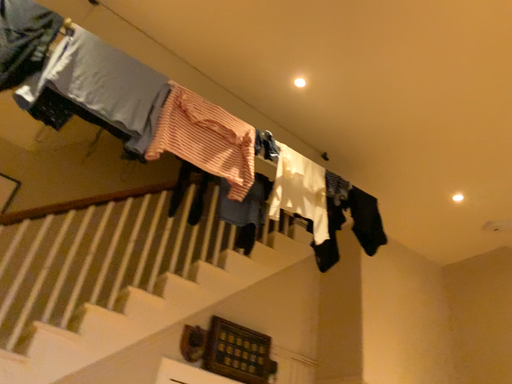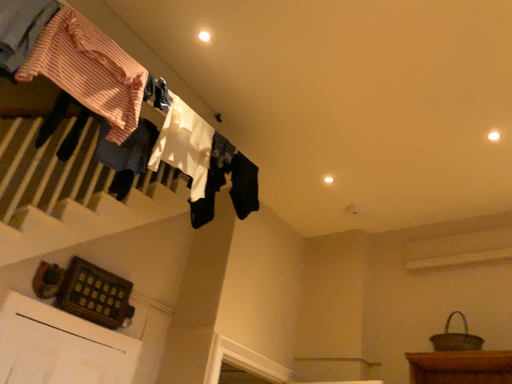
Question: Which way did the camera rotate in the video?

Choices:
 (A) rotated right
 (B) rotated left

Answer: (A)